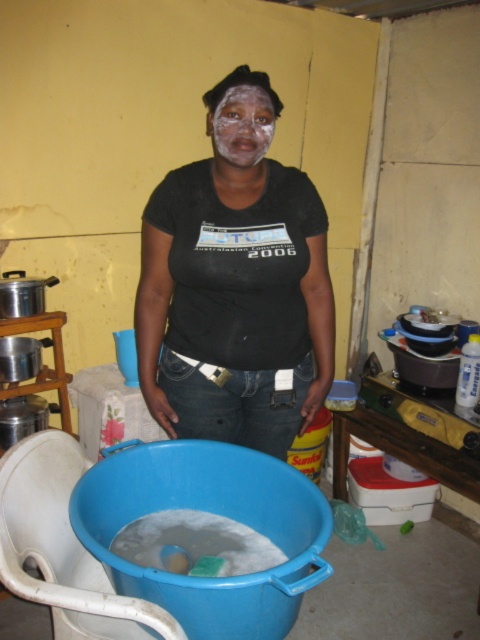
Question: Based on their relative distances, which object is nearer to the blue plastic basin at lower center?

Choices:
 (A) white matte face at center
 (B) matte black shirt at center

Answer: (B)

Question: Does matte black shirt at center have a lesser width compared to white matte face at center?

Choices:
 (A) no
 (B) yes

Answer: (A)

Question: Among these points, which one is farthest from the camera?

Choices:
 (A) (255, 138)
 (B) (287, 625)

Answer: (A)

Question: Does blue plastic basin at lower center come in front of white matte face at center?

Choices:
 (A) no
 (B) yes

Answer: (B)

Question: Which of the following is the closest to the observer?

Choices:
 (A) (309, 520)
 (B) (230, 154)

Answer: (A)

Question: Is the position of matte black shirt at center more distant than that of blue plastic basin at lower center?

Choices:
 (A) yes
 (B) no

Answer: (A)